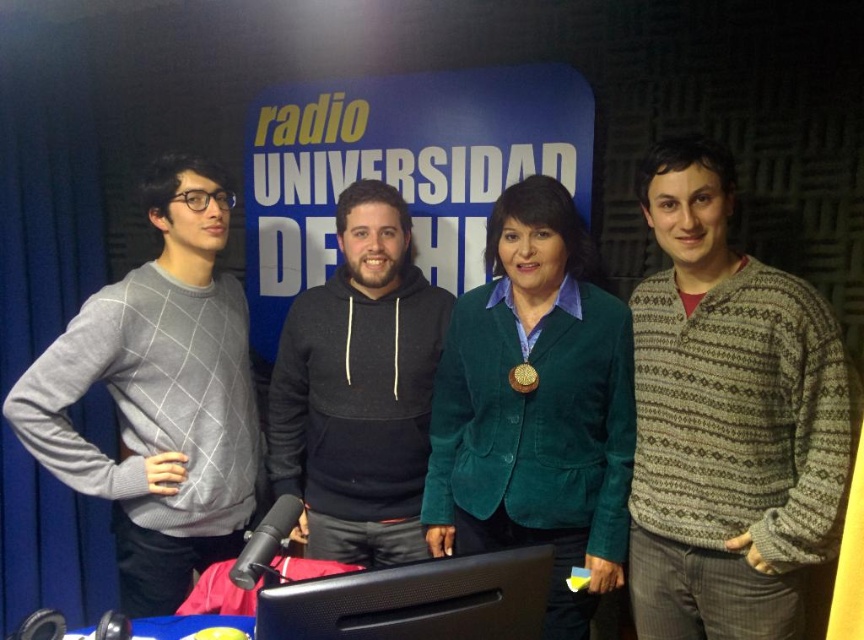
Between point (439, 483) and point (507, 372), which one is positioned in front?

Point (507, 372) is more forward.

Measure the distance between green corduroy blazer at center and camera.

green corduroy blazer at center and camera are 5.70 feet apart.

This screenshot has height=640, width=864. Describe the element at coordinates (535, 406) in the screenshot. I see `green corduroy blazer at center` at that location.

Image resolution: width=864 pixels, height=640 pixels. I want to click on green corduroy blazer at center, so click(x=535, y=406).

Can you confirm if knitted wool sweater at right is thinner than green corduroy blazer at center?

Yes, knitted wool sweater at right is thinner than green corduroy blazer at center.

Can you confirm if knitted wool sweater at right is positioned to the left of green corduroy blazer at center?

In fact, knitted wool sweater at right is to the right of green corduroy blazer at center.

The width and height of the screenshot is (864, 640). Find the location of `knitted wool sweater at right`. knitted wool sweater at right is located at coordinates (729, 419).

Locate an element on the screen. This screenshot has height=640, width=864. green corduroy blazer at center is located at coordinates (535, 406).

Who is more forward, (462,298) or (216,184)?

Positioned in front is point (216,184).

Measure the distance between green corduroy blazer at center and camera.

green corduroy blazer at center is 5.70 feet from camera.

What are the coordinates of `green corduroy blazer at center` in the screenshot? It's located at (535, 406).